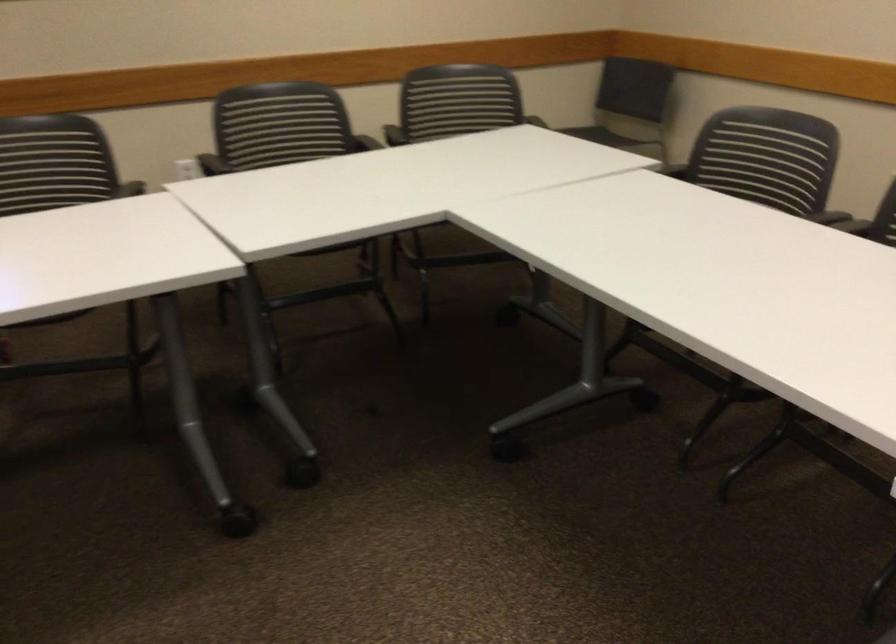
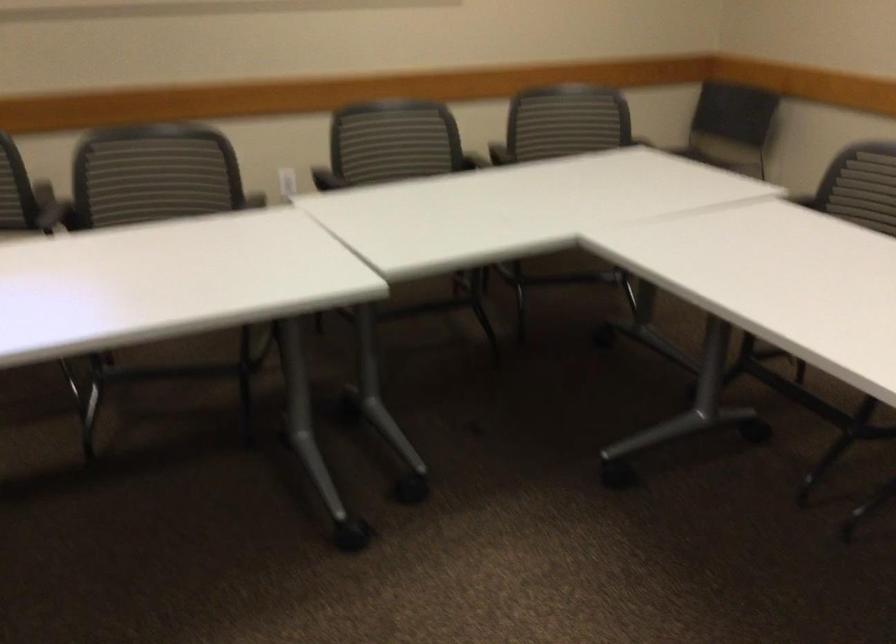
Question: I am providing you with two images of the same scene from different viewpoints. Please identify which objects are invisible in image2.

Choices:
 (A) chair armrest
 (B) chair sitting surface
 (C) black chair sitting surface
 (D) metal handle

Answer: (C)